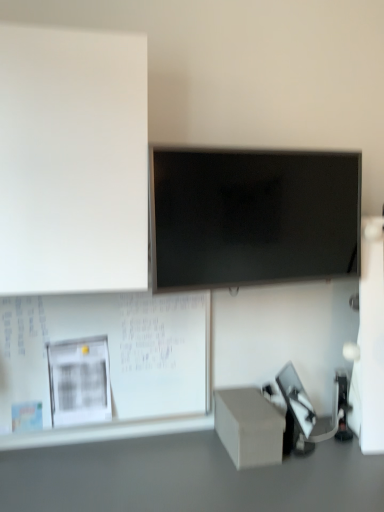
The width and height of the screenshot is (384, 512). Describe the element at coordinates (73, 161) in the screenshot. I see `white matte board at upper left, marked as the second bulletin board in a bottom-to-top arrangement` at that location.

Measure the distance between point (130, 407) and camera.

Point (130, 407) and camera are 5.13 feet apart from each other.

In order to face matte black screen at center, should I rotate leftwards or rightwards?

Rotate your view right by about 9.609°.

Where is `white matte board at upper left, positioned as the first bulletin board in top-to-bottom order`? white matte board at upper left, positioned as the first bulletin board in top-to-bottom order is located at coordinates (73, 161).

In terms of width, does white matte bulletin board at lower left, arranged as the 1th bulletin board when ordered from the bottom, look wider or thinner when compared to white matte board at upper left, marked as the second bulletin board in a bottom-to-top arrangement?

In the image, white matte bulletin board at lower left, arranged as the 1th bulletin board when ordered from the bottom, appears to be more narrow than white matte board at upper left, marked as the second bulletin board in a bottom-to-top arrangement.

Is white matte bulletin board at lower left, arranged as the 1th bulletin board when ordered from the bottom, with white matte board at upper left, positioned as the first bulletin board in top-to-bottom order?

white matte bulletin board at lower left, arranged as the 1th bulletin board when ordered from the bottom, and white matte board at upper left, positioned as the first bulletin board in top-to-bottom order, are not in contact.

Which of these two, white matte bulletin board at lower left, arranged as the 1th bulletin board when ordered from the bottom, or white matte board at upper left, marked as the second bulletin board in a bottom-to-top arrangement, stands taller?

white matte board at upper left, marked as the second bulletin board in a bottom-to-top arrangement.

Is white matte board at upper left, positioned as the first bulletin board in top-to-bottom order, bigger than matte black screen at center?

Correct, white matte board at upper left, positioned as the first bulletin board in top-to-bottom order, is larger in size than matte black screen at center.

How much distance is there between white matte board at upper left, positioned as the first bulletin board in top-to-bottom order, and matte black screen at center?

They are 12.04 inches apart.

Considering the relative positions of white matte board at upper left, marked as the second bulletin board in a bottom-to-top arrangement, and matte black screen at center in the image provided, is white matte board at upper left, marked as the second bulletin board in a bottom-to-top arrangement, to the left of matte black screen at center from the viewer's perspective?

Yes.

Could you tell me if white matte board at upper left, positioned as the first bulletin board in top-to-bottom order, is facing matte black screen at center?

No, white matte board at upper left, positioned as the first bulletin board in top-to-bottom order, is not aimed at matte black screen at center.

Does smooth gray table at lower center contain white matte board at upper left, marked as the second bulletin board in a bottom-to-top arrangement?

No, white matte board at upper left, marked as the second bulletin board in a bottom-to-top arrangement, is not a part of smooth gray table at lower center.

From the picture: From the image's perspective, which is above, smooth gray table at lower center or white matte board at upper left, marked as the second bulletin board in a bottom-to-top arrangement?

From the image's view, white matte board at upper left, marked as the second bulletin board in a bottom-to-top arrangement, is above.

From a real-world perspective, is smooth gray table at lower center on top of white matte board at upper left, positioned as the first bulletin board in top-to-bottom order?

No.

Which is further, (258, 152) or (39, 62)?

The point (258, 152) is more distant.

Between matte black screen at center and white matte board at upper left, positioned as the first bulletin board in top-to-bottom order, which one has smaller width?

With smaller width is matte black screen at center.

Considering the relative positions of matte black screen at center and white matte board at upper left, positioned as the first bulletin board in top-to-bottom order, in the image provided, is matte black screen at center to the right of white matte board at upper left, positioned as the first bulletin board in top-to-bottom order, from the viewer's perspective?

Correct, you'll find matte black screen at center to the right of white matte board at upper left, positioned as the first bulletin board in top-to-bottom order.

Which of these two, matte black screen at center or white matte board at upper left, marked as the second bulletin board in a bottom-to-top arrangement, is bigger?

Answer: With larger size is white matte board at upper left, marked as the second bulletin board in a bottom-to-top arrangement.

Is matte gray cube at lower right aimed at white matte board at upper left, marked as the second bulletin board in a bottom-to-top arrangement?

No, matte gray cube at lower right is not oriented towards white matte board at upper left, marked as the second bulletin board in a bottom-to-top arrangement.

Identify the location of box that appears below the white matte board at upper left, marked as the second bulletin board in a bottom-to-top arrangement (from a real-world perspective). 249,426.

Is matte gray cube at lower right at the left side of white matte board at upper left, positioned as the first bulletin board in top-to-bottom order?

In fact, matte gray cube at lower right is to the right of white matte board at upper left, positioned as the first bulletin board in top-to-bottom order.

Who is shorter, smooth gray table at lower center or white matte bulletin board at lower left, the 2th bulletin board when ordered from top to bottom?

smooth gray table at lower center is shorter.

Who is bigger, smooth gray table at lower center or white matte bulletin board at lower left, the 2th bulletin board when ordered from top to bottom?

Bigger between the two is smooth gray table at lower center.

From the image's perspective, is smooth gray table at lower center located above white matte bulletin board at lower left, the 2th bulletin board when ordered from top to bottom?

No, from the image's perspective, smooth gray table at lower center is not above white matte bulletin board at lower left, the 2th bulletin board when ordered from top to bottom.

Does point (314, 498) come in front of point (26, 303)?

Yes, it is.

Between white matte board at upper left, marked as the second bulletin board in a bottom-to-top arrangement, and smooth gray table at lower center, which one has more height?

Standing taller between the two is white matte board at upper left, marked as the second bulletin board in a bottom-to-top arrangement.

Is white matte board at upper left, marked as the second bulletin board in a bottom-to-top arrangement, behind smooth gray table at lower center?

That is True.

From a real-world perspective, is white matte board at upper left, marked as the second bulletin board in a bottom-to-top arrangement, positioned over smooth gray table at lower center based on gravity?

Indeed, from a real-world perspective, white matte board at upper left, marked as the second bulletin board in a bottom-to-top arrangement, stands above smooth gray table at lower center.

Find the location of `bulletin board that is the 1st one when counting backward from the smooth gray table at lower center`. bulletin board that is the 1st one when counting backward from the smooth gray table at lower center is located at coordinates (73, 161).

Image resolution: width=384 pixels, height=512 pixels. What are the coordinates of `bulletin board above the white matte bulletin board at lower left, the 2th bulletin board when ordered from top to bottom (from a real-world perspective)` in the screenshot? It's located at (73, 161).

Where is `bulletin board in front of the matte black screen at center`? Image resolution: width=384 pixels, height=512 pixels. bulletin board in front of the matte black screen at center is located at coordinates (73, 161).

Considering their positions, is smooth gray table at lower center positioned further to matte black screen at center than white matte board at upper left, marked as the second bulletin board in a bottom-to-top arrangement?

smooth gray table at lower center is positioned further to the anchor matte black screen at center.

Which object lies nearer to the anchor point matte gray cube at lower right, white matte bulletin board at lower left, arranged as the 1th bulletin board when ordered from the bottom, or matte black screen at center?

white matte bulletin board at lower left, arranged as the 1th bulletin board when ordered from the bottom, is closer to matte gray cube at lower right.

Which object lies nearer to the anchor point smooth gray table at lower center, matte black screen at center or matte gray cube at lower right?

matte gray cube at lower right is positioned closer to the anchor smooth gray table at lower center.

Looking at this image, when comparing their distances from smooth gray table at lower center, does white matte board at upper left, positioned as the first bulletin board in top-to-bottom order, or white matte bulletin board at lower left, the 2th bulletin board when ordered from top to bottom, seem further?

white matte board at upper left, positioned as the first bulletin board in top-to-bottom order, lies further to smooth gray table at lower center than the other object.

From the image, which object appears to be nearer to white matte board at upper left, marked as the second bulletin board in a bottom-to-top arrangement, white matte bulletin board at lower left, arranged as the 1th bulletin board when ordered from the bottom, or matte black screen at center?

matte black screen at center is closer to white matte board at upper left, marked as the second bulletin board in a bottom-to-top arrangement.

From the image, which object appears to be farther from matte black screen at center, smooth gray table at lower center or matte gray cube at lower right?

smooth gray table at lower center is further to matte black screen at center.

Which object lies further to the anchor point matte black screen at center, white matte board at upper left, positioned as the first bulletin board in top-to-bottom order, or smooth gray table at lower center?

smooth gray table at lower center is positioned further to the anchor matte black screen at center.

Based on their spatial positions, is matte gray cube at lower right or matte black screen at center further from smooth gray table at lower center?

Among the two, matte black screen at center is located further to smooth gray table at lower center.

Identify the location of television between white matte board at upper left, marked as the second bulletin board in a bottom-to-top arrangement, and white matte bulletin board at lower left, arranged as the 1th bulletin board when ordered from the bottom, vertically. (253, 217).

Locate an element on the screen. television between white matte board at upper left, positioned as the first bulletin board in top-to-bottom order, and matte gray cube at lower right, in the vertical direction is located at coordinates (253, 217).

Identify the location of table between white matte bulletin board at lower left, arranged as the 1th bulletin board when ordered from the bottom, and matte gray cube at lower right. The image size is (384, 512). (186, 477).

The image size is (384, 512). Identify the location of television between white matte board at upper left, marked as the second bulletin board in a bottom-to-top arrangement, and smooth gray table at lower center vertically. (253, 217).